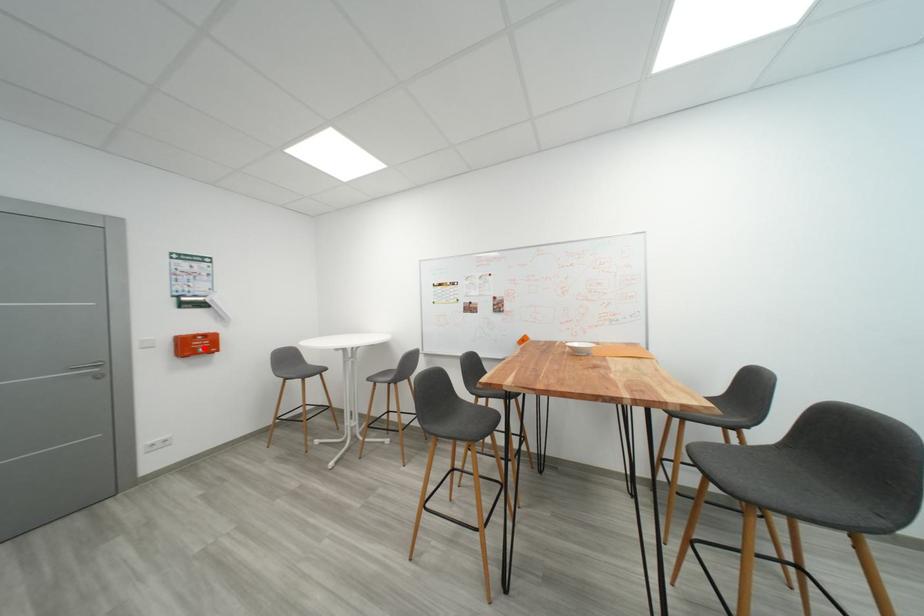
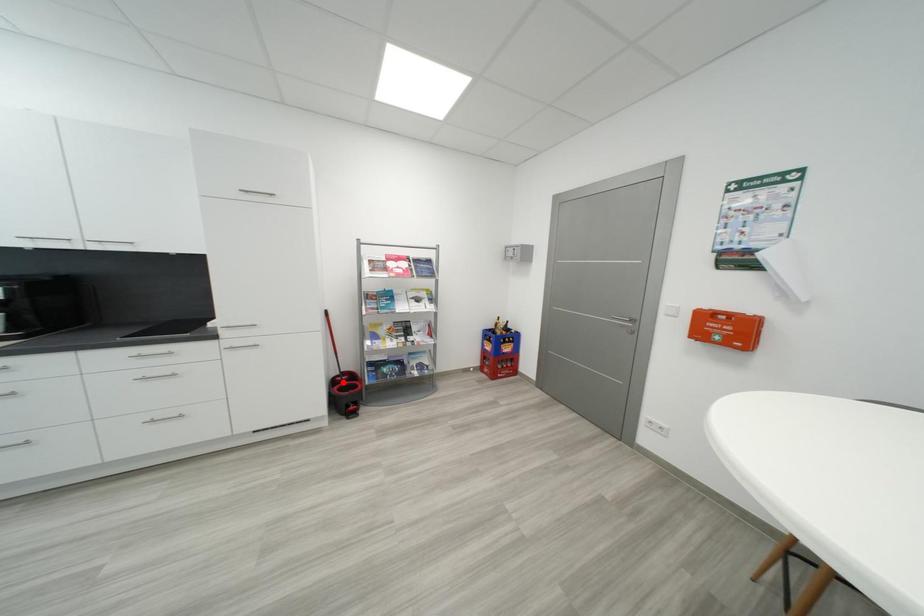
I am providing you with two images of the same scene from different viewpoints. A red point is marked on the first image and another point is marked on the second image. Does the point marked in image1 correspond to the same location as the one in image2?

No